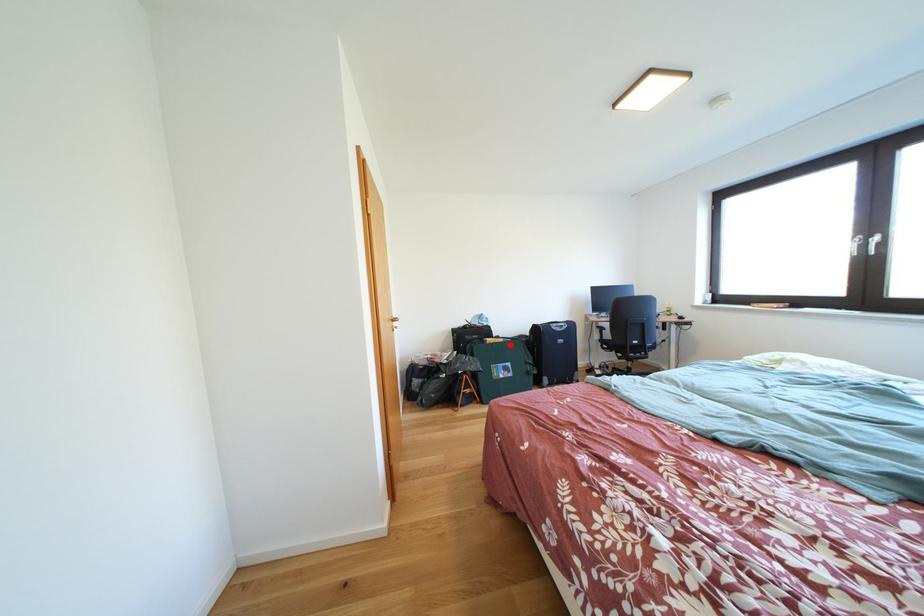
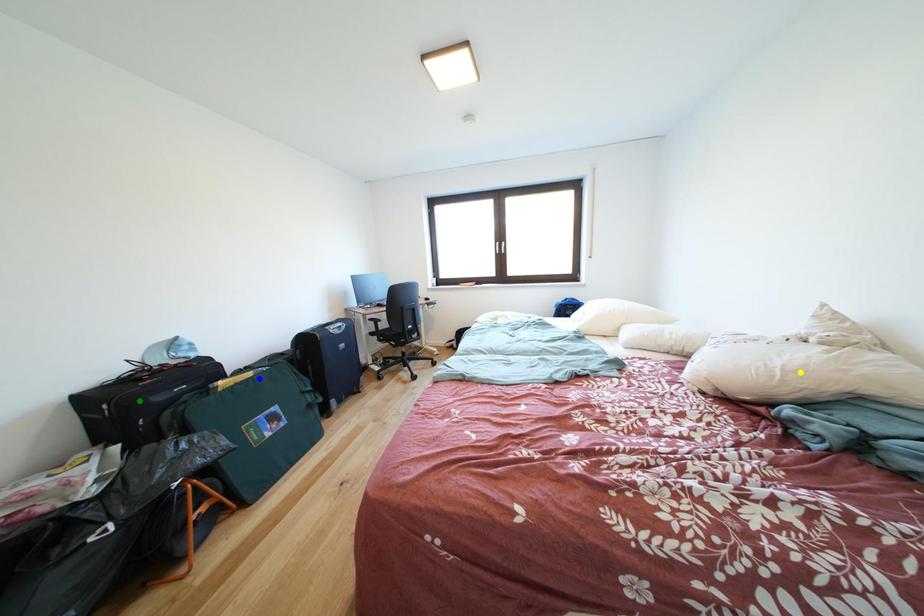
Question: I am providing you with two images of the same scene from different viewpoints. A red point is marked on the first image. You are given multiple points on the second image. Which point in image 2 represents the same 3d spot as the red point in image 1?

Choices:
 (A) yellow point
 (B) blue point
 (C) green point

Answer: (B)